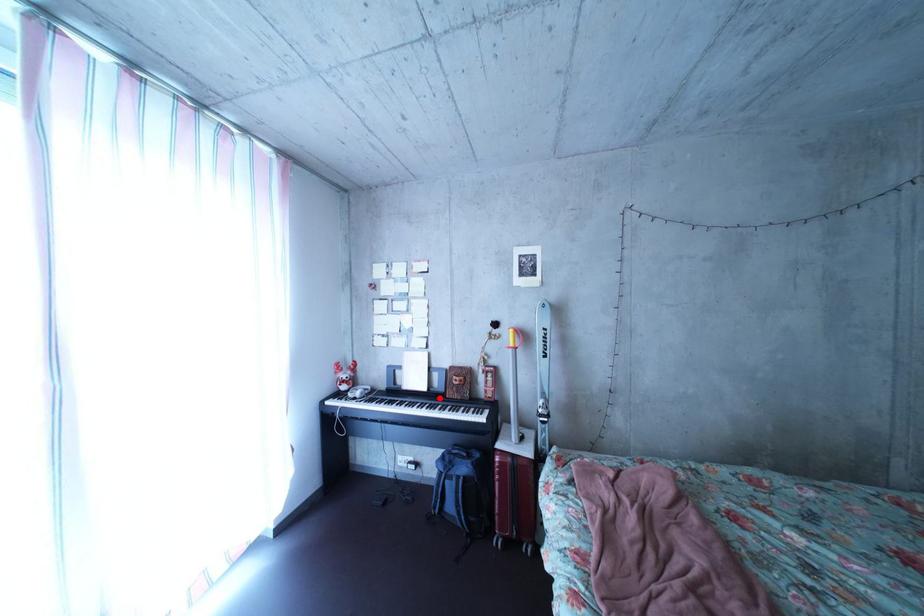
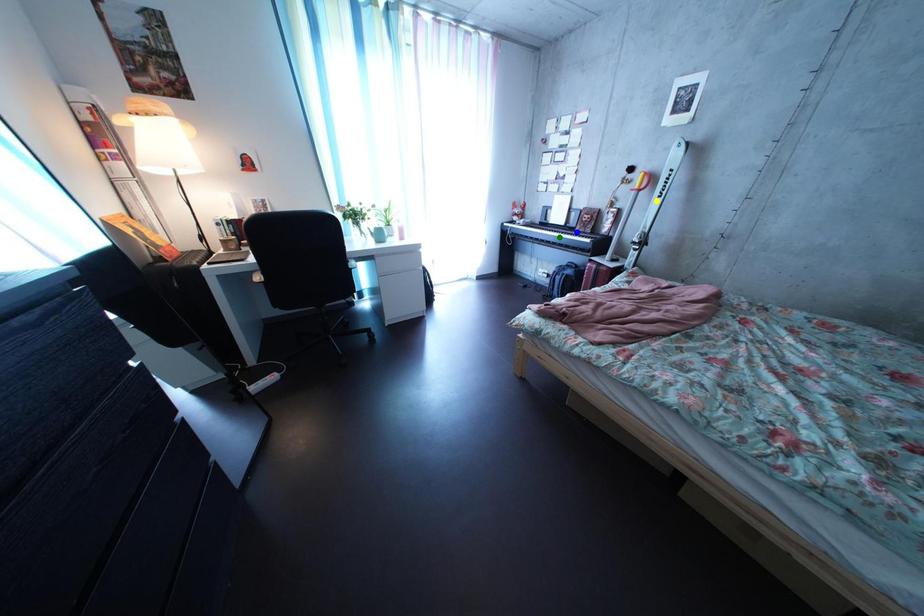
Question: I am providing you with two images of the same scene from different viewpoints. A red point is marked on the first image. You are given multiple points on the second image. Which spot in image 2 lines up with the point in image 1?

Choices:
 (A) yellow point
 (B) green point
 (C) blue point

Answer: (C)